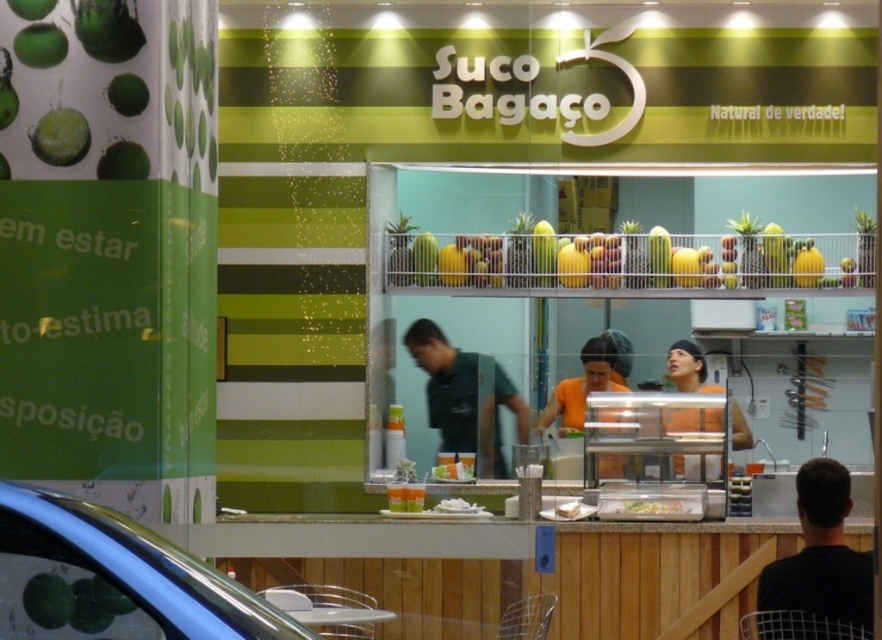
Question: Which point is closer to the camera taking this photo?

Choices:
 (A) (830, 612)
 (B) (664, 500)
 (C) (128, 156)

Answer: (C)

Question: Is orange fabric shirt at center below white paper plate at center?

Choices:
 (A) no
 (B) yes

Answer: (A)

Question: Which object is the farthest from the green matte apple at upper left?

Choices:
 (A) dark green uniform at center
 (B) white paper plate at center
 (C) black matte person at lower right

Answer: (C)

Question: Is dark green uniform at center bigger than translucent plastic tray at center?

Choices:
 (A) no
 (B) yes

Answer: (B)

Question: Is black matte person at lower right bigger than translucent plastic tray at center?

Choices:
 (A) no
 (B) yes

Answer: (B)

Question: Which is farther from the black matte person at lower right?

Choices:
 (A) metallic silver car at lower left
 (B) translucent plastic tray at center
 (C) green matte pineapple at upper left

Answer: (C)